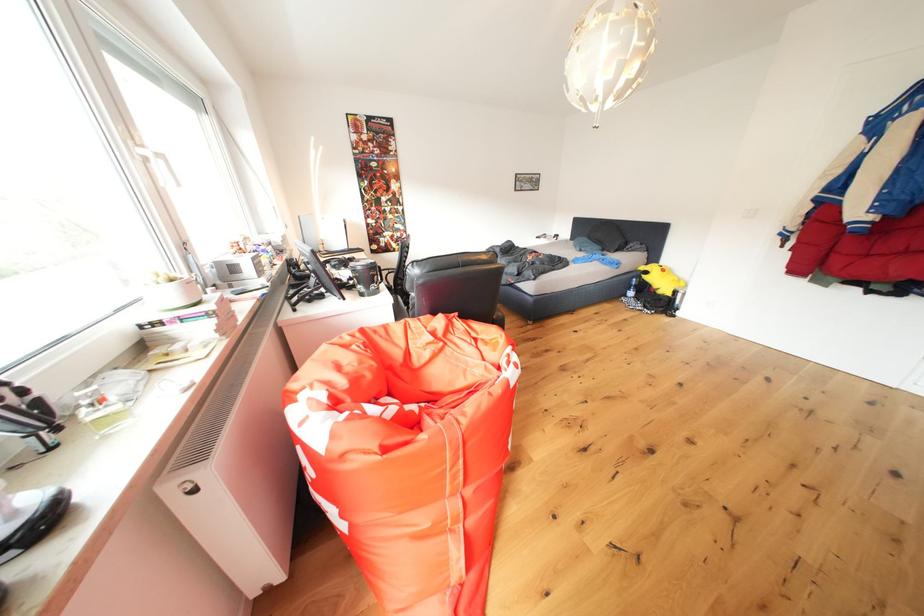
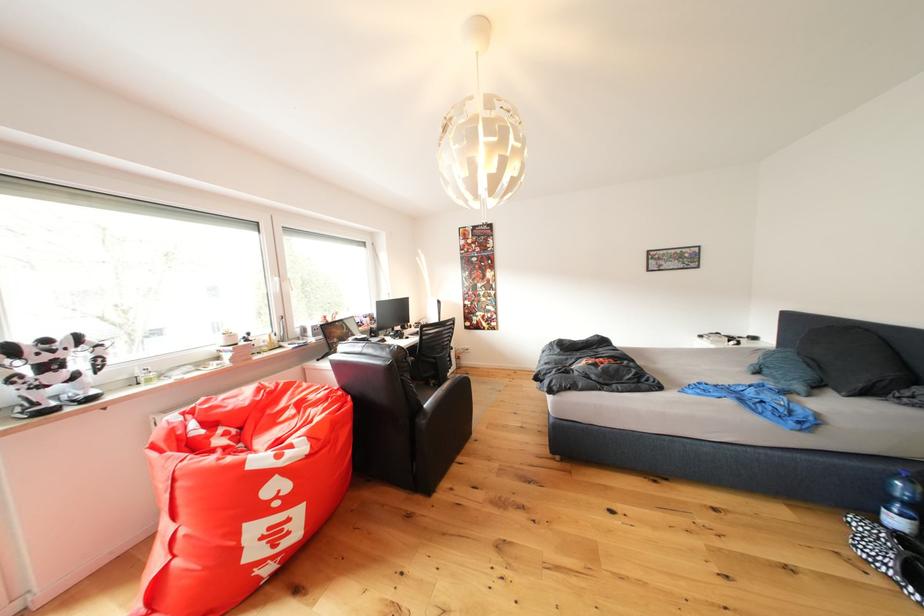
In the second image, find the point that corresponds to the point at 640,299 in the first image.

(906, 527)